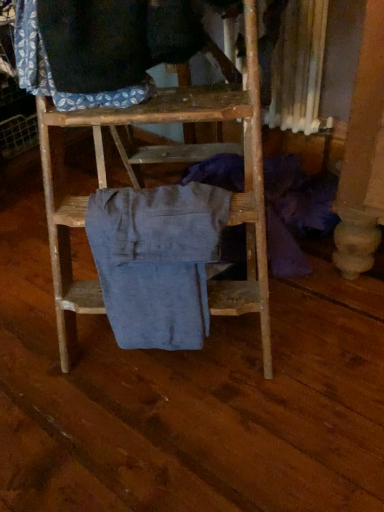
The width and height of the screenshot is (384, 512). I want to click on free space above denim pants at center, the 2th clothing when ordered from left to right (from a real-world perspective), so click(165, 196).